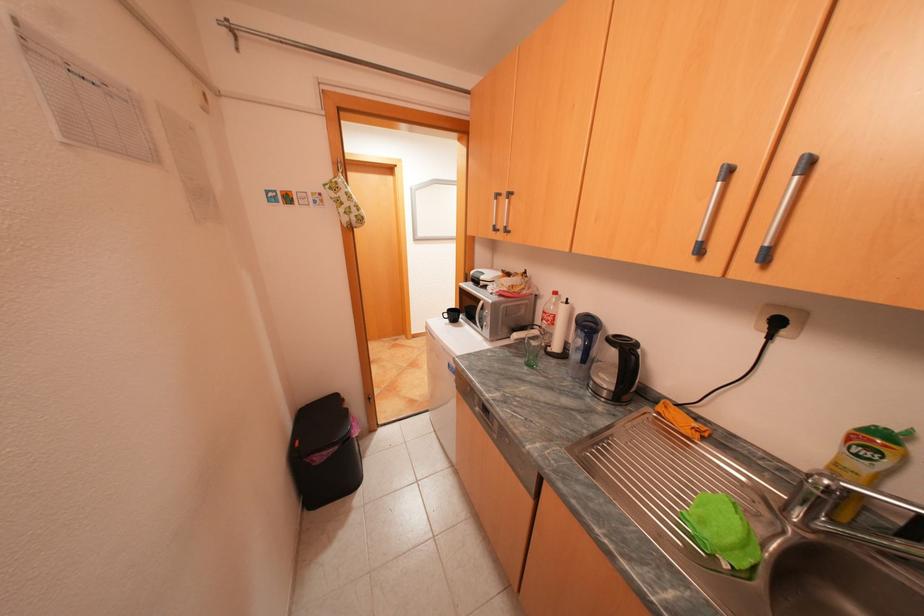
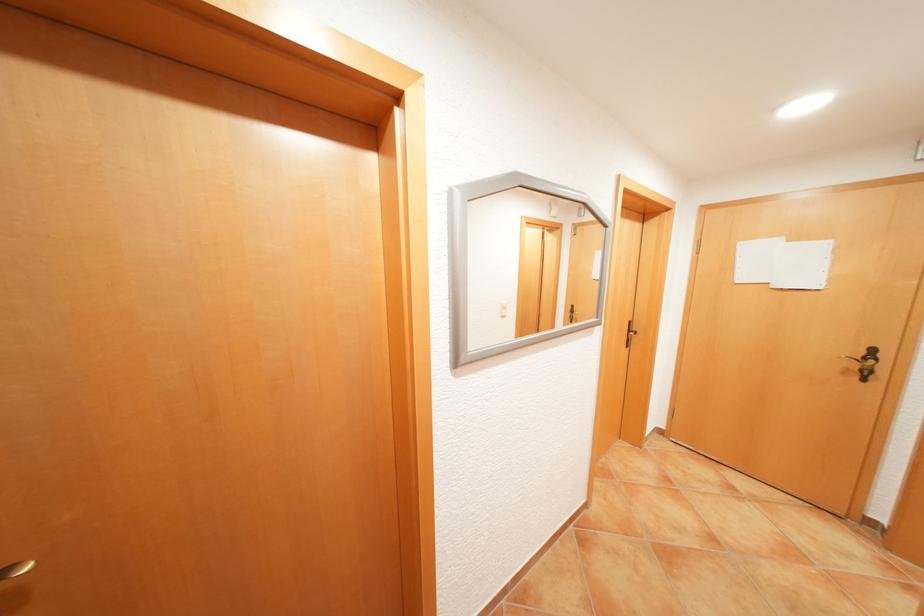
Question: Which direction would the cameraman need to move to produce the second image? Reply with the corresponding letter.

Choices:
 (A) Left
 (B) Right
 (C) Forward
 (D) Backward

Answer: (C)